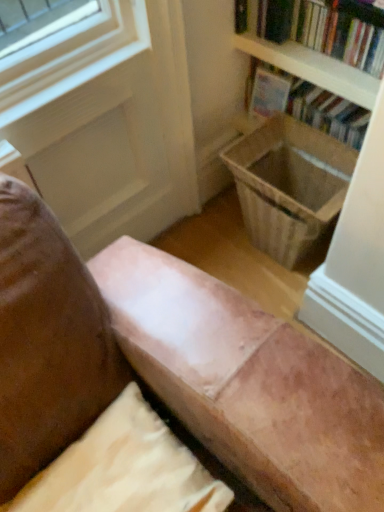
Question: Does hardcover book at upper right, the 2th book from the front, contain wooden laundry basket at lower right?

Choices:
 (A) yes
 (B) no

Answer: (B)

Question: Considering the relative sizes of hardcover book at upper right, the 2th book from the front, and wooden laundry basket at lower right in the image provided, is hardcover book at upper right, the 2th book from the front, taller than wooden laundry basket at lower right?

Choices:
 (A) yes
 (B) no

Answer: (A)

Question: From a real-world perspective, is hardcover book at upper right, the 2th book from the front, physically below wooden laundry basket at lower right?

Choices:
 (A) yes
 (B) no

Answer: (B)

Question: Does hardcover book at upper right, the 1th book in the back-to-front sequence, turn towards wooden laundry basket at lower right?

Choices:
 (A) no
 (B) yes

Answer: (B)

Question: Does hardcover book at upper right, the 2th book from the front, appear on the left side of wooden laundry basket at lower right?

Choices:
 (A) no
 (B) yes

Answer: (A)

Question: From the image's perspective, relative to suede-like beige pillow at lower center, is hardcover book at upper right, the 2th book from the front, above or below?

Choices:
 (A) above
 (B) below

Answer: (A)

Question: Considering the relative positions of hardcover book at upper right, the 1th book in the back-to-front sequence, and suede-like beige pillow at lower center in the image provided, is hardcover book at upper right, the 1th book in the back-to-front sequence, to the left or to the right of suede-like beige pillow at lower center?

Choices:
 (A) right
 (B) left

Answer: (A)

Question: From a real-world perspective, relative to suede-like beige pillow at lower center, is hardcover book at upper right, the 1th book in the back-to-front sequence, vertically above or below?

Choices:
 (A) above
 (B) below

Answer: (B)

Question: Looking at their shapes, would you say hardcover book at upper right, the 1th book in the back-to-front sequence, is wider or thinner than suede-like beige pillow at lower center?

Choices:
 (A) thin
 (B) wide

Answer: (A)

Question: Considering the positions of point (271, 119) and point (332, 12), is point (271, 119) closer or farther from the camera than point (332, 12)?

Choices:
 (A) closer
 (B) farther

Answer: (B)

Question: Considering the positions of wooden laundry basket at lower right and hardcover book at upper right, which appears as the 2th book when viewed from the back, in the image, is wooden laundry basket at lower right wider or thinner than hardcover book at upper right, which appears as the 2th book when viewed from the back,?

Choices:
 (A) thin
 (B) wide

Answer: (B)

Question: From a real-world perspective, is wooden laundry basket at lower right positioned above or below hardcover book at upper right, which appears as the 2th book when viewed from the back?

Choices:
 (A) below
 (B) above

Answer: (A)

Question: Based on their sizes in the image, would you say wooden laundry basket at lower right is bigger or smaller than hardcover book at upper right, which appears as the 2th book when viewed from the back?

Choices:
 (A) big
 (B) small

Answer: (B)

Question: From a real-world perspective, is hardcover book at upper right, which appears as the 2th book when viewed from the back, physically located above or below hardcover book at upper right, the 1th book in the back-to-front sequence?

Choices:
 (A) above
 (B) below

Answer: (A)

Question: Is hardcover book at upper right, which appears as the 2th book when viewed from the back, inside or outside of hardcover book at upper right, the 1th book in the back-to-front sequence?

Choices:
 (A) outside
 (B) inside

Answer: (A)